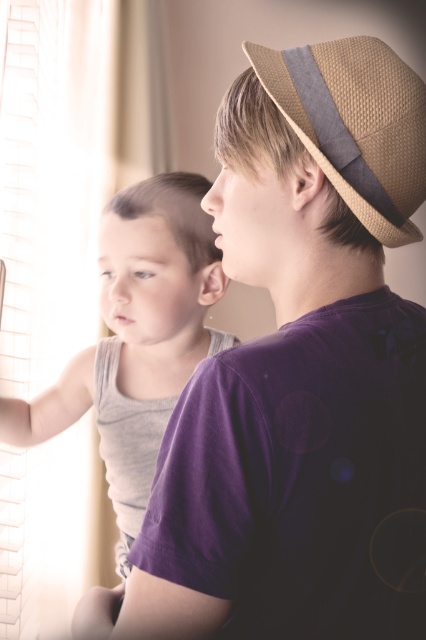
From the picture: You are a photographer setting up a shot of the two boys near the window. You need to ensure that the purple cotton shirt at upper right and the braided straw hat at upper right are both in focus. Given their height difference, which object should you adjust your camera focus on first to ensure both are sharp?

The purple cotton shirt at upper right is much taller than the braided straw hat at upper right. To ensure both are in focus, you should focus on the purple cotton shirt at upper right first, as it is the taller object, and then adjust the focus to include the shorter braided straw hat at upper right.